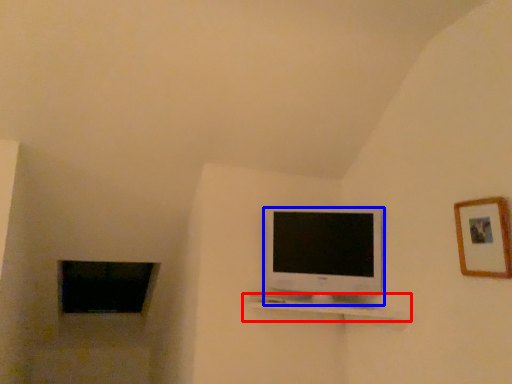
Question: Which point is further to the camera, shelf (highlighted by a red box) or television (highlighted by a blue box)?

Choices:
 (A) shelf
 (B) television

Answer: (B)